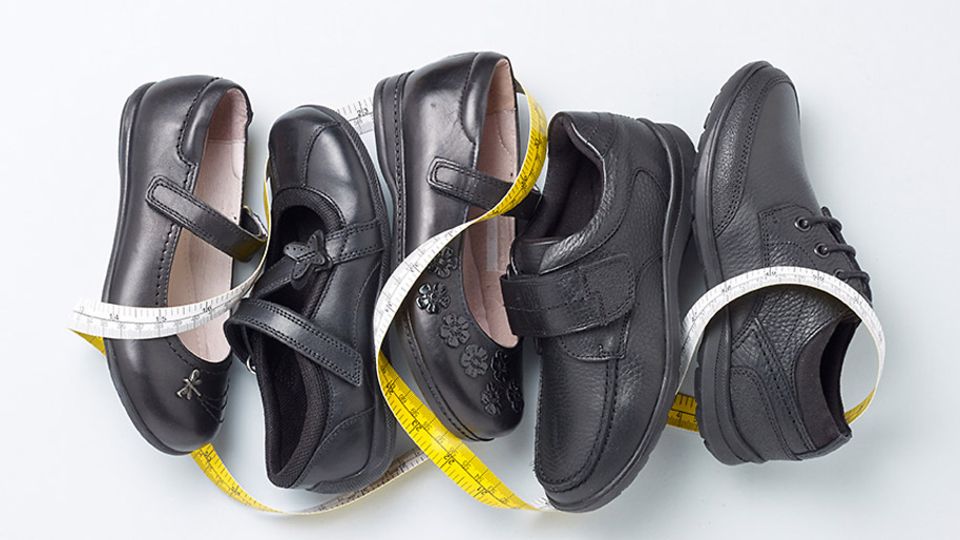
In order to click on shoe in this screenshot , I will do `click(196, 298)`, `click(313, 405)`, `click(441, 340)`, `click(588, 362)`, `click(733, 320)`.